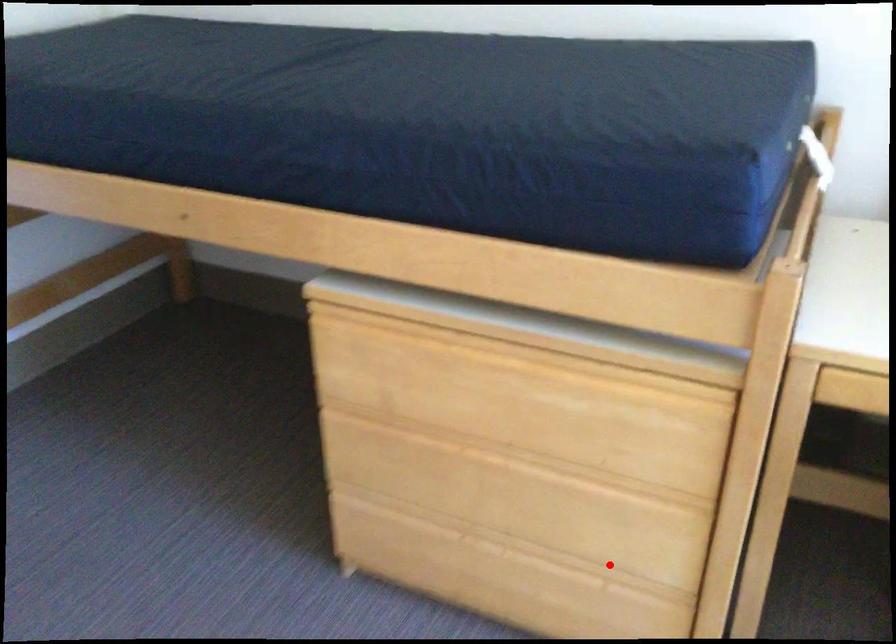
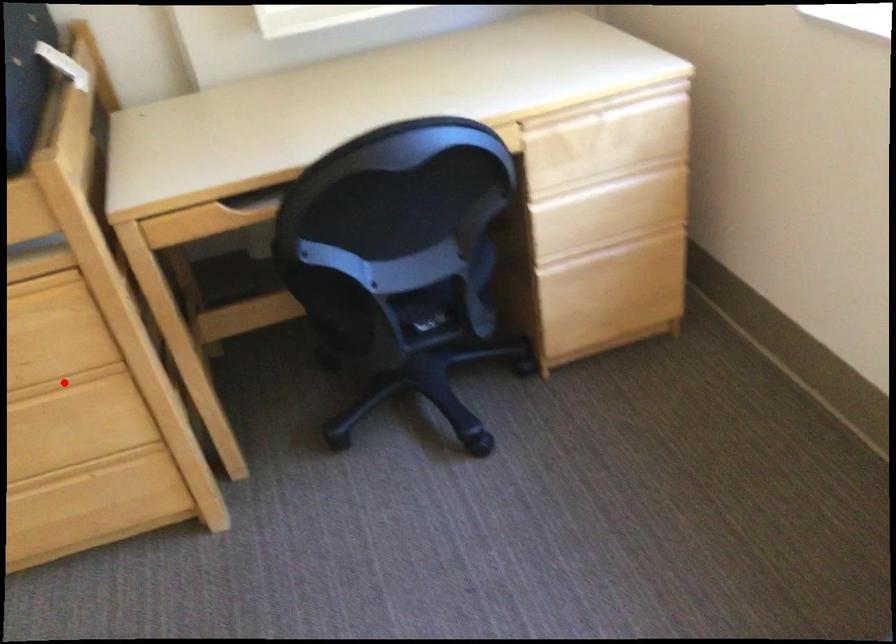
I am providing you with two images of the same scene from different viewpoints. A red point is marked on the first image and another point is marked on the second image. Are the points marked in image1 and image2 representing the same 3D position?

No